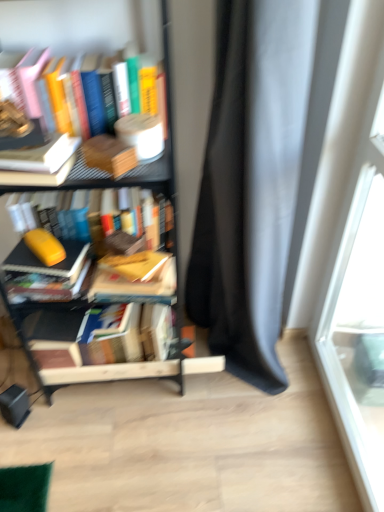
Question: Should I look upward or downward to see orange matte book at center, which appears as the fourth book when ordered from the bottom?

Choices:
 (A) down
 (B) up

Answer: (B)

Question: From a real-world perspective, is hardcover book at upper left, positioned as the 1th book in top-to-bottom order, located beneath yellow matte book at left, which is the 2th paperback book in right-to-left order?

Choices:
 (A) yes
 (B) no

Answer: (B)

Question: Is hardcover book at upper left, positioned as the 1th book in top-to-bottom order, smaller than yellow matte book at left, which ranks as the second paperback book in front-to-back order?

Choices:
 (A) yes
 (B) no

Answer: (B)

Question: Is hardcover book at upper left, positioned as the 1th book in top-to-bottom order, to the left of yellow matte book at left, which is the 2th paperback book in right-to-left order, from the viewer's perspective?

Choices:
 (A) no
 (B) yes

Answer: (A)

Question: Is hardcover book at upper left, arranged as the 6th book when ordered from the bottom, behind yellow matte book at left, which is the first paperback book from left to right?

Choices:
 (A) no
 (B) yes

Answer: (A)

Question: Is hardcover book at upper left, positioned as the 1th book in top-to-bottom order, wider than yellow matte book at left, the 1th paperback book viewed from the back?

Choices:
 (A) no
 (B) yes

Answer: (B)

Question: Can you confirm if hardcover book at upper left, positioned as the 1th book in top-to-bottom order, is bigger than yellow matte book at left, which is the 2th paperback book in right-to-left order?

Choices:
 (A) no
 (B) yes

Answer: (B)

Question: Is yellow matte book at left, the 1th paperback book viewed from the back, wider than hardcover book at upper left, positioned as the 1th book in top-to-bottom order?

Choices:
 (A) no
 (B) yes

Answer: (A)

Question: From the image's perspective, does yellow matte book at left, which is the first paperback book from left to right, appear higher than hardcover book at upper left, positioned as the 1th book in top-to-bottom order?

Choices:
 (A) yes
 (B) no

Answer: (B)

Question: Is yellow matte book at left, the 1th paperback book in the bottom-to-top sequence, to the left of hardcover book at upper left, positioned as the 1th book in top-to-bottom order, from the viewer's perspective?

Choices:
 (A) no
 (B) yes

Answer: (B)

Question: From a real-world perspective, does yellow matte book at left, marked as the 2th paperback book in a top-to-bottom arrangement, sit lower than hardcover book at upper left, positioned as the 1th book in top-to-bottom order?

Choices:
 (A) yes
 (B) no

Answer: (A)

Question: From the image's perspective, is yellow matte book at left, which is the 2th paperback book in right-to-left order, beneath hardcover book at upper left, arranged as the 6th book when ordered from the bottom?

Choices:
 (A) yes
 (B) no

Answer: (A)

Question: Is hardcover book at upper left, positioned as the 1th book in top-to-bottom order, located within yellow matte book at left, the 1th paperback book viewed from the back?

Choices:
 (A) no
 (B) yes

Answer: (A)

Question: Would you say matte yellow book at left, the 2th book from the bottom, is a long distance from orange matte book at center, which appears as the fourth book when ordered from the bottom?

Choices:
 (A) yes
 (B) no

Answer: (B)